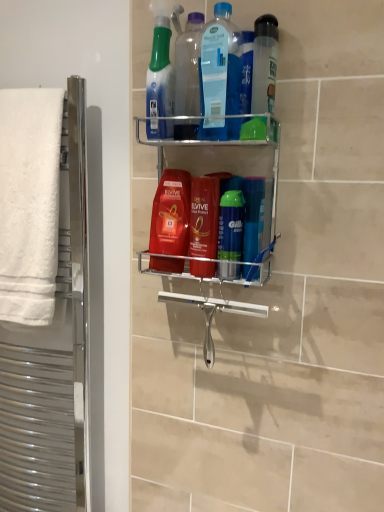
Question: Does point (160, 44) appear closer or farther from the camera than point (178, 106)?

Choices:
 (A) closer
 (B) farther

Answer: (A)

Question: Is translucent plastic spray bottle at upper center, the first cleaning product from the top, inside or outside of transparent plastic bottle at upper center?

Choices:
 (A) outside
 (B) inside

Answer: (A)

Question: Which of these objects is positioned farthest from the white fluffy towel at left?

Choices:
 (A) white towel at left
 (B) green matte mouthwash at center, placed as the 2th mouthwash when sorted from left to right
 (C) metallic silver shelf at center
 (D) blue translucent bottle at upper center, arranged as the second cleaning product when viewed from the top
 (E) translucent plastic spray bottle at upper center, the 3th cleaning product in the bottom-to-top sequence

Answer: (B)

Question: Considering the real-world distances, which object is closest to the metallic silver shelf at center?

Choices:
 (A) translucent plastic spray bottle at upper center, the first cleaning product from the top
 (B) white fluffy towel at left
 (C) transparent plastic bottle at upper center
 (D) white towel at left
 (E) blue translucent bottle at upper center, placed as the second cleaning product when sorted from bottom to top

Answer: (E)